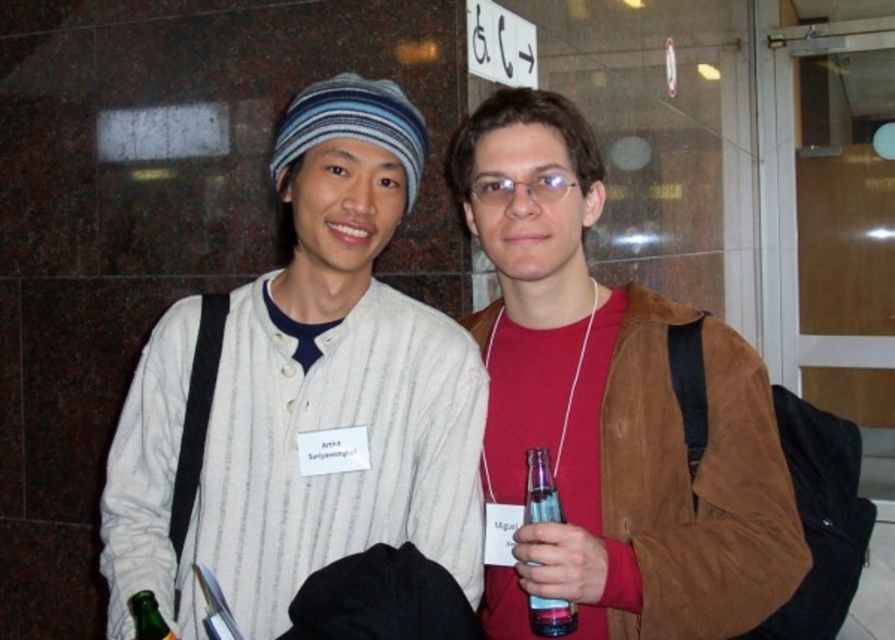
Question: Is white striped shirt at center to the right of green glass bottle at lower left from the viewer's perspective?

Choices:
 (A) yes
 (B) no

Answer: (A)

Question: In this image, where is white striped shirt at center located relative to brown suede jacket at center?

Choices:
 (A) below
 (B) above

Answer: (A)

Question: Which object appears farthest from the camera in this image?

Choices:
 (A) white striped shirt at center
 (B) green glass bottle at lower left
 (C) translucent plastic bottle at center
 (D) brown suede jacket at center

Answer: (A)

Question: Can you confirm if white striped shirt at center is positioned above green glass bottle at lower left?

Choices:
 (A) no
 (B) yes

Answer: (B)

Question: Which point is closer to the camera taking this photo?

Choices:
 (A) (531, 506)
 (B) (710, 380)

Answer: (A)

Question: Which is farther from the green glass bottle at lower left?

Choices:
 (A) white striped shirt at center
 (B) translucent plastic bottle at center

Answer: (B)